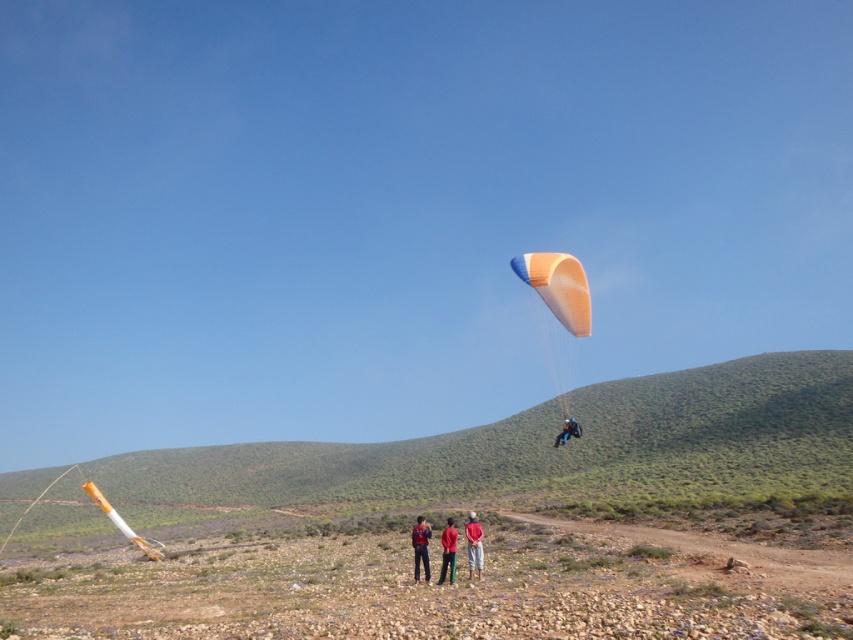
Locate an element on the screen. Image resolution: width=853 pixels, height=640 pixels. red fabric jacket at center is located at coordinates (421, 547).

Does point (419, 538) come in front of point (444, 552)?

That is False.

Is point (415, 564) positioned in front of point (438, 582)?

No, it is behind (438, 582).

Locate an element on the screen. red fabric jacket at center is located at coordinates (421, 547).

Is point (517, 259) farther from camera compared to point (451, 518)?

That is True.

Does point (572, 285) come behind point (451, 532)?

Yes, it is behind point (451, 532).

Locate an element on the screen. Image resolution: width=853 pixels, height=640 pixels. orange fabric parachute at center is located at coordinates (556, 307).

Which is more to the right, orange fabric parachute at center or red cotton shirt at center?

Positioned to the right is orange fabric parachute at center.

Describe the element at coordinates (556, 307) in the screenshot. This screenshot has height=640, width=853. I see `orange fabric parachute at center` at that location.

The width and height of the screenshot is (853, 640). Find the location of `orange fabric parachute at center`. orange fabric parachute at center is located at coordinates (556, 307).